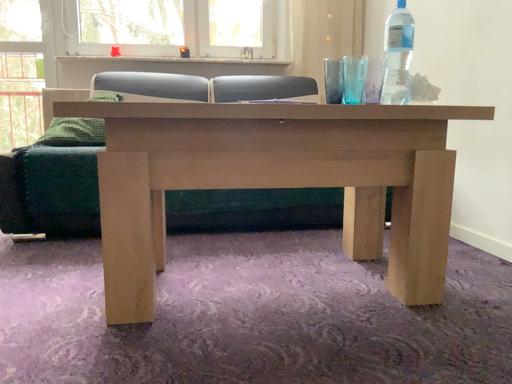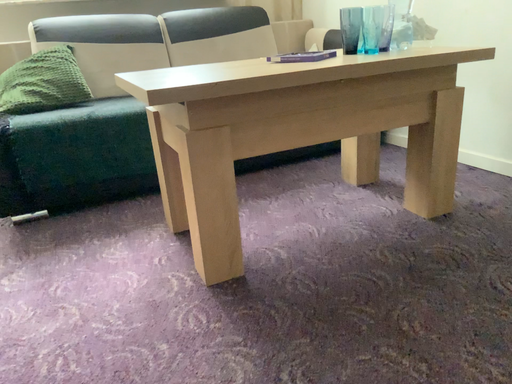
Question: How did the camera likely rotate when shooting the video?

Choices:
 (A) rotated downward
 (B) rotated upward

Answer: (A)